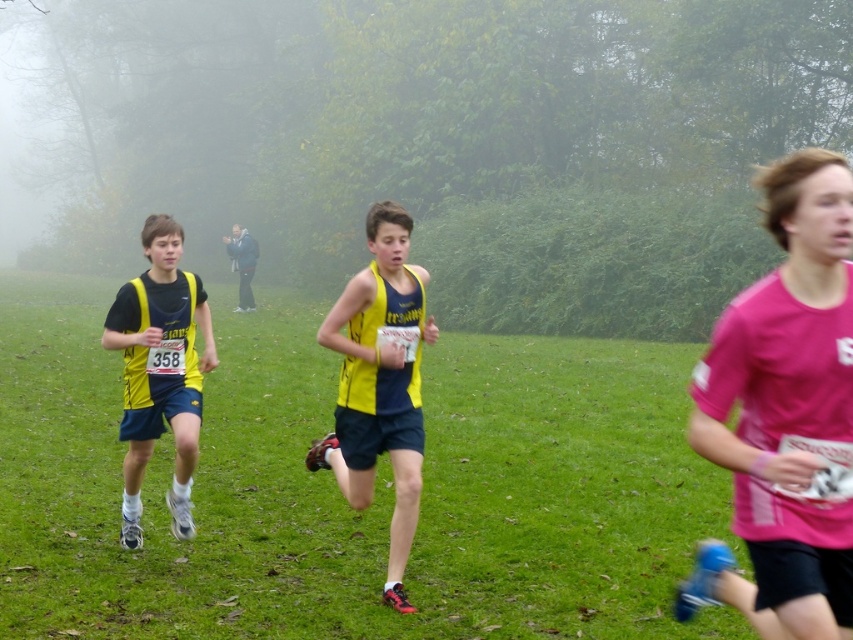
You are a spectator at the cross country race. You see the matte yellow and black running outfit at left and the dark blue jacket at center. Which one is positioned to the right side?

The matte yellow and black running outfit at left is positioned to the right of the dark blue jacket at center.

You are a photographer positioned at the origin point of the image. You want to capture a closeup shot of the yellow matte tank top at center. According to the coordinate system provided, where should you aim your camera?

The yellow matte tank top at center is located at coordinate point (379, 381), so you should aim your camera at that position to capture it.

You are a photographer positioned at the center of the image. You want to take a photo of the pink fabric shirt at right. Which direction should you move to get a better shot?

The pink fabric shirt at right is located at point 0.645 on the x and 0.920 on the y. Since you are at the center, you should move to the right and slightly upwards to align with the shirt.